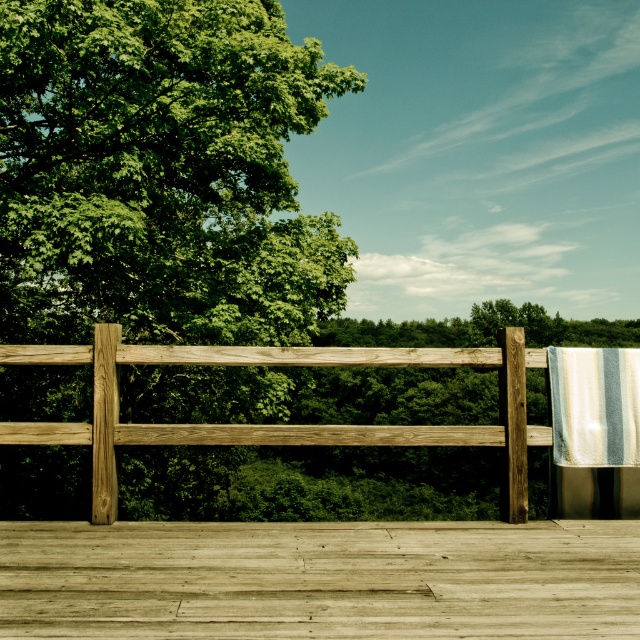
Question: Is green matte wood at left closer to the viewer compared to striped fabric at right?

Choices:
 (A) no
 (B) yes

Answer: (A)

Question: In this image, where is green matte wood at left located relative to striped fabric at right?

Choices:
 (A) left
 (B) right

Answer: (A)

Question: Considering the real-world distances, which object is farthest from the wooden deck at center?

Choices:
 (A) striped fabric at right
 (B) wooden fence at center

Answer: (B)

Question: Estimate the real-world distances between objects in this image. Which object is farther from the wooden deck at center?

Choices:
 (A) wooden fence at center
 (B) striped fabric at right

Answer: (A)

Question: Which point is closer to the camera?

Choices:
 (A) (189, 515)
 (B) (524, 560)

Answer: (B)

Question: In this image, where is wooden deck at center located relative to striped fabric at right?

Choices:
 (A) above
 (B) below

Answer: (B)